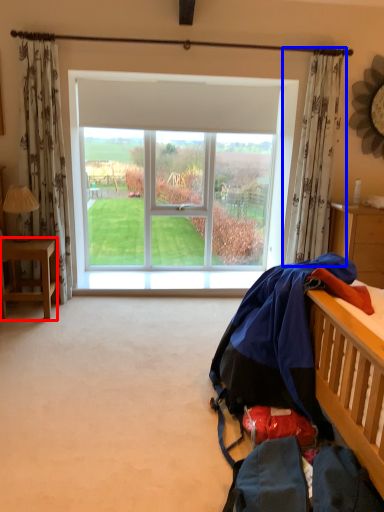
Question: Which of the following is the farthest to the observer, desk (highlighted by a red box) or curtain (highlighted by a blue box)?

Choices:
 (A) desk
 (B) curtain

Answer: (B)